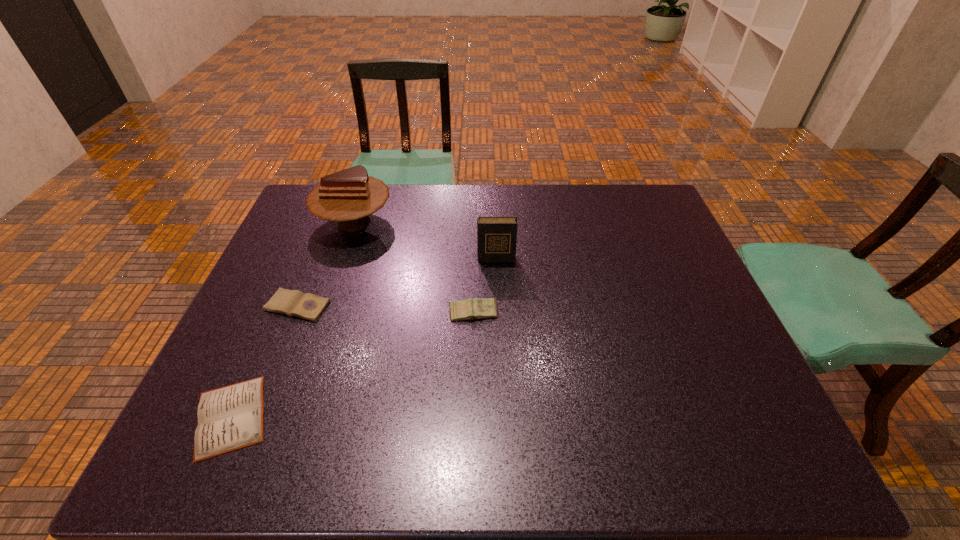
At what (x,y) coordinates should I click in order to perform the action: click on cake. Please return your answer as a coordinate pair (x, y). The image size is (960, 540). Looking at the image, I should click on (348, 197).

Where is `the fourth nearest object`? The image size is (960, 540). the fourth nearest object is located at coordinates (496, 236).

Identify the location of the farthest diary. (496, 236).

What are the coordinates of `the third shortest diary` in the screenshot? It's located at (478, 308).

Where is `the nearest diary`? Image resolution: width=960 pixels, height=540 pixels. the nearest diary is located at coordinates (229, 418).

The width and height of the screenshot is (960, 540). I want to click on vacant region located 0.090m on the front of the cake, so click(x=339, y=267).

Where is `free spot located 0.100m on the front cover of the second farthest object`? This screenshot has height=540, width=960. free spot located 0.100m on the front cover of the second farthest object is located at coordinates (497, 287).

Locate an element on the screen. The height and width of the screenshot is (540, 960). blank area located 0.170m on the right of the third tallest object is located at coordinates (564, 313).

Locate an element on the screen. Image resolution: width=960 pixels, height=540 pixels. blank area located 0.320m on the right of the nearest object is located at coordinates (425, 416).

This screenshot has width=960, height=540. I want to click on object situated at the far edge, so click(348, 197).